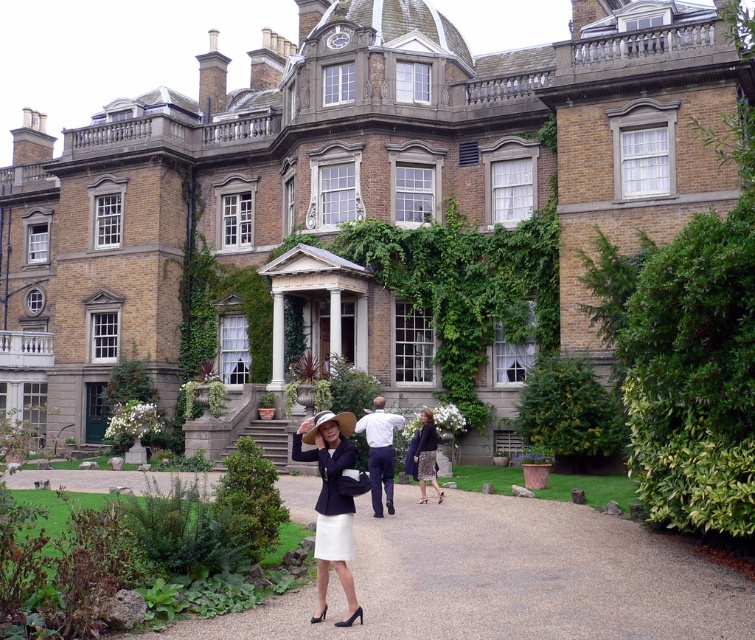
You are attending an event at this historic building and notice two items of clothing placed on a bench at the center of the entrance area. The items are the white cotton shirt at center and the dark gray skirt at center. Which clothing item is wider?

The white cotton shirt at center is wider than the dark gray skirt at center.

You are an architect visiting the brown brick mansion at center and the matte black blazer at center. You need to determine which object is larger in size. Which one is bigger?

The brown brick mansion at center is bigger than the matte black blazer at center, so the brown brick mansion at center is larger in size.

You are standing in front of the brown brick mansion at center and want to reach the matte black blazer at center. Which direction should you move to get there?

The brown brick mansion at center is to the left of matte black blazer at center, so you should move to the right to reach the matte black blazer at center.